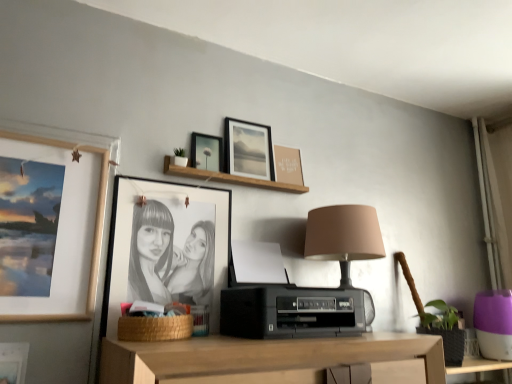
Question: Should I look upward or downward to see matte black picture frame at upper center, the 4th picture frame from the left?

Choices:
 (A) up
 (B) down

Answer: (A)

Question: Can you confirm if matte black picture frame at upper left, which ranks as the 6th picture frame in right-to-left order, is shorter than matte brown picture frame at upper center, which is counted as the sixth picture frame, starting from the left?

Choices:
 (A) no
 (B) yes

Answer: (B)

Question: Is matte black picture frame at upper left, which is the first picture frame in left-to-right order, facing towards matte brown picture frame at upper center, which is counted as the sixth picture frame, starting from the left?

Choices:
 (A) no
 (B) yes

Answer: (A)

Question: Is matte black picture frame at upper left, which is the first picture frame in left-to-right order, bigger than matte brown picture frame at upper center, which appears as the 1th picture frame when viewed from the right?

Choices:
 (A) yes
 (B) no

Answer: (A)

Question: Is matte brown picture frame at upper center, which appears as the 1th picture frame when viewed from the right, inside matte black picture frame at upper left, which is the first picture frame in left-to-right order?

Choices:
 (A) yes
 (B) no

Answer: (B)

Question: From a real-world perspective, is matte black picture frame at upper left, which ranks as the 6th picture frame in right-to-left order, physically above matte brown picture frame at upper center, which appears as the 1th picture frame when viewed from the right?

Choices:
 (A) no
 (B) yes

Answer: (A)

Question: From a real-world perspective, is matte black picture frame at upper left, which is the first picture frame in left-to-right order, positioned under matte brown picture frame at upper center, which is counted as the sixth picture frame, starting from the left, based on gravity?

Choices:
 (A) no
 (B) yes

Answer: (B)

Question: Can you confirm if woven brown basket at lower center is wider than matte wooden picture frame at left, which appears as the fifth picture frame when viewed from the right?

Choices:
 (A) yes
 (B) no

Answer: (A)

Question: Is matte wooden picture frame at left, which appears as the 2th picture frame when viewed from the left, at the back of woven brown basket at lower center?

Choices:
 (A) no
 (B) yes

Answer: (A)

Question: From a real-world perspective, does woven brown basket at lower center sit lower than matte wooden picture frame at left, which appears as the fifth picture frame when viewed from the right?

Choices:
 (A) yes
 (B) no

Answer: (A)

Question: Is woven brown basket at lower center not inside matte wooden picture frame at left, which appears as the 2th picture frame when viewed from the left?

Choices:
 (A) yes
 (B) no

Answer: (A)

Question: Is woven brown basket at lower center surrounding matte wooden picture frame at left, which appears as the 2th picture frame when viewed from the left?

Choices:
 (A) yes
 (B) no

Answer: (B)

Question: Considering the relative sizes of woven brown basket at lower center and matte wooden picture frame at left, which appears as the fifth picture frame when viewed from the right, in the image provided, is woven brown basket at lower center smaller than matte wooden picture frame at left, which appears as the fifth picture frame when viewed from the right,?

Choices:
 (A) yes
 (B) no

Answer: (A)

Question: Is matte brown picture frame at upper center, which appears as the 1th picture frame when viewed from the right, a part of matte black picture frame at upper center, the 4th picture frame from the left?

Choices:
 (A) yes
 (B) no

Answer: (B)